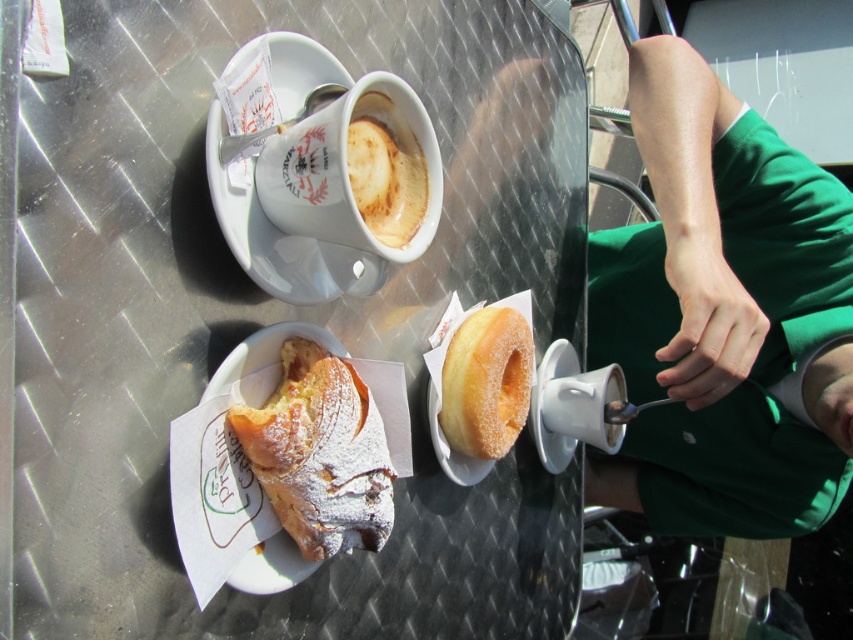
Question: Can you confirm if metallic silver table at center is positioned above sugared doughnut at center?

Choices:
 (A) yes
 (B) no

Answer: (A)

Question: Among these points, which one is nearest to the camera?

Choices:
 (A) (346, 160)
 (B) (715, 225)

Answer: (A)

Question: Can you confirm if powdered sugar croissant at lower left is smaller than sugared doughnut at center?

Choices:
 (A) yes
 (B) no

Answer: (B)

Question: Which object is farther from the camera taking this photo?

Choices:
 (A) sugared doughnut at center
 (B) powdered sugar croissant at lower left
 (C) metallic silver table at center
 (D) white frothy coffee at upper center

Answer: (A)

Question: Is green fabric shirt at upper right closer to the viewer compared to white ceramic cup at upper center?

Choices:
 (A) yes
 (B) no

Answer: (B)

Question: Which point is farther from the camera taking this photo?

Choices:
 (A) (445, 422)
 (B) (419, 256)
 (C) (357, 209)
 (D) (489, 486)

Answer: (D)